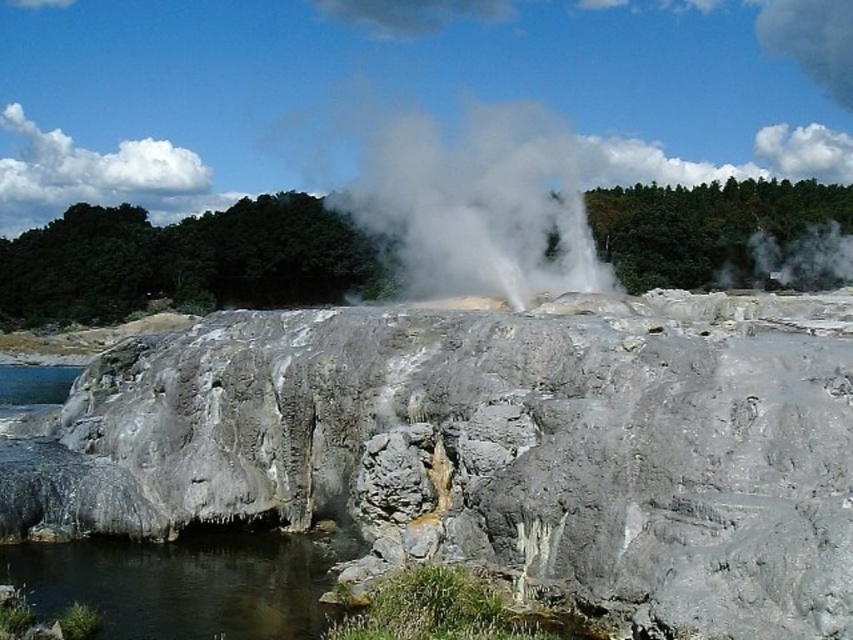
You are a geologist observing the gray rough cliff at center and the white vapor at center in the geothermal area. Which of the two is shorter in height?

The gray rough cliff at center is shorter in height compared to the white vapor at center.

You are a geologist measuring the distance between two points in a geothermal area. You need to determine if a 100 meter long safety rope can span from the white vapor at center to the clear water at lower left. Can the rope reach?

The distance between the white vapor at center and the clear water at lower left is 98.59 meters. Since the safety rope is 100 meters long, it can comfortably span the distance between the white vapor at center and the clear water at lower left.